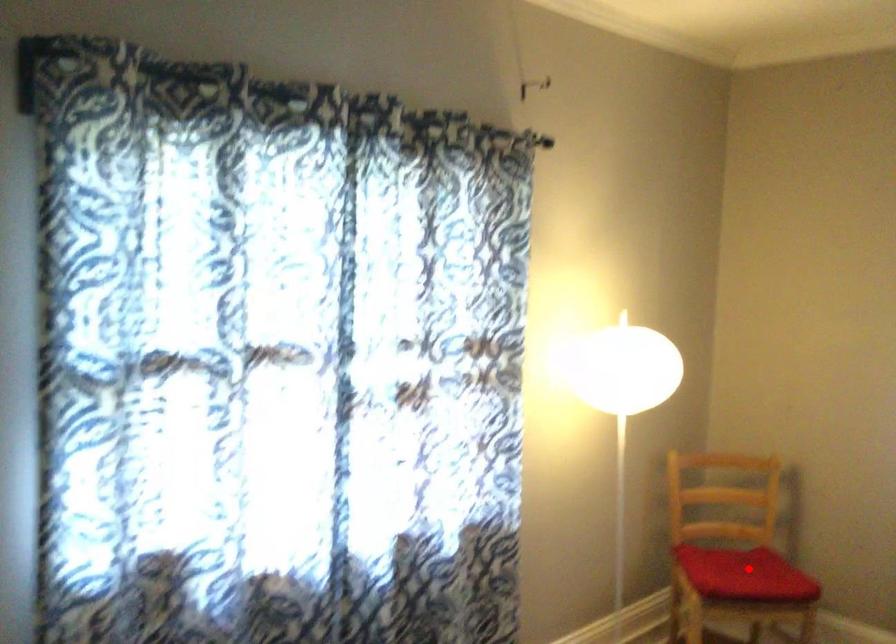
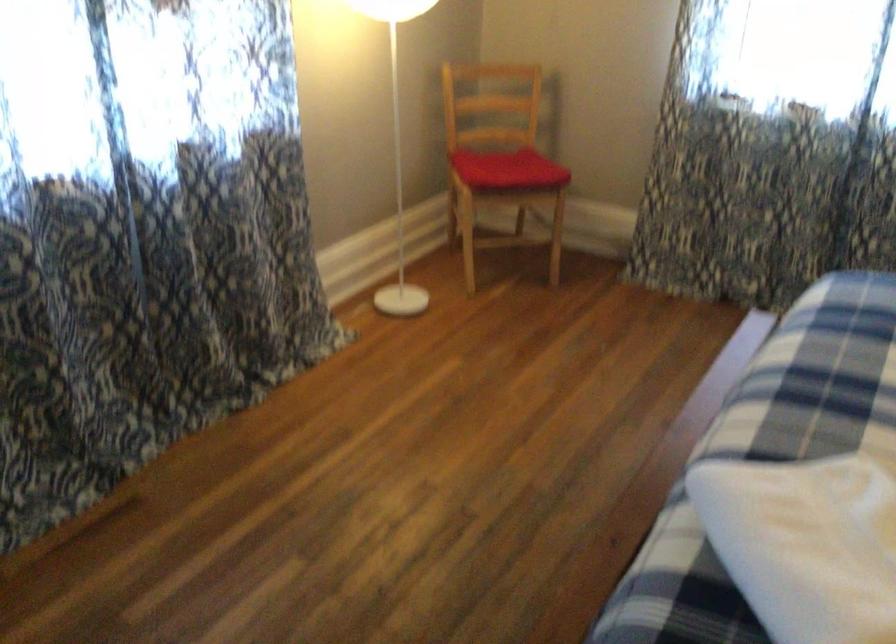
Question: I am providing you with two images of the same scene from different viewpoints. Image1 has a red point marked. In image2, the corresponding 3D location appears at what relative position? Reply with the corresponding letter.

Choices:
 (A) Closer
 (B) Farther

Answer: (B)